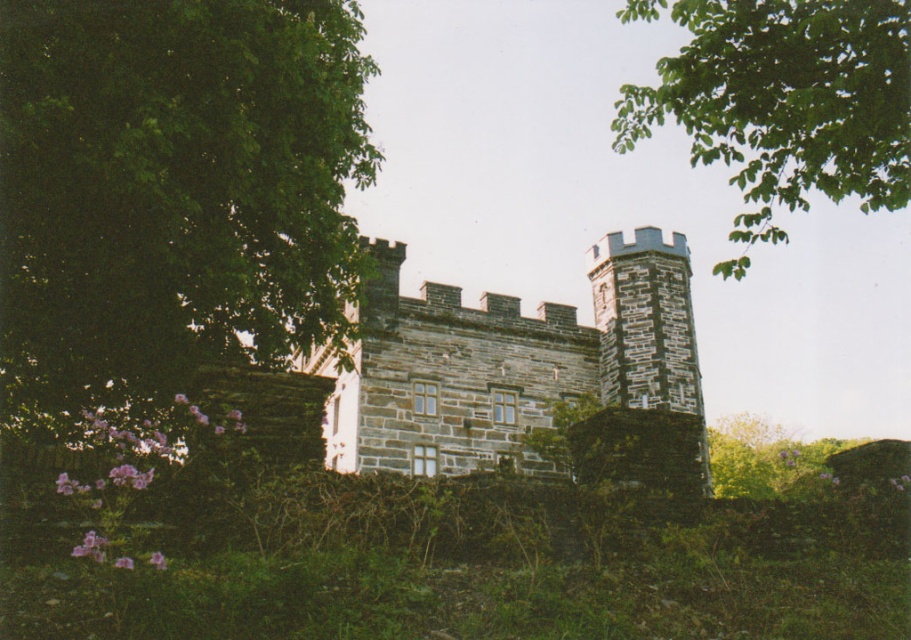
Question: Is green leafy tree at left further to camera compared to gray stone castle at center?

Choices:
 (A) no
 (B) yes

Answer: (A)

Question: Can you confirm if green leafy tree at left is positioned to the left of green leafy tree at upper right?

Choices:
 (A) yes
 (B) no

Answer: (A)

Question: Is green leafy tree at left above green leafy tree at upper right?

Choices:
 (A) no
 (B) yes

Answer: (A)

Question: Which object is the closest to the gray stone castle at center?

Choices:
 (A) green leafy tree at upper right
 (B) green leafy tree at left

Answer: (B)

Question: Which object appears farthest from the camera in this image?

Choices:
 (A) green leafy tree at left
 (B) green leafy tree at upper right
 (C) gray stone castle at center

Answer: (B)

Question: Based on their relative distances, which object is farther from the green leafy tree at upper right?

Choices:
 (A) gray stone castle at center
 (B) green leafy tree at left

Answer: (B)